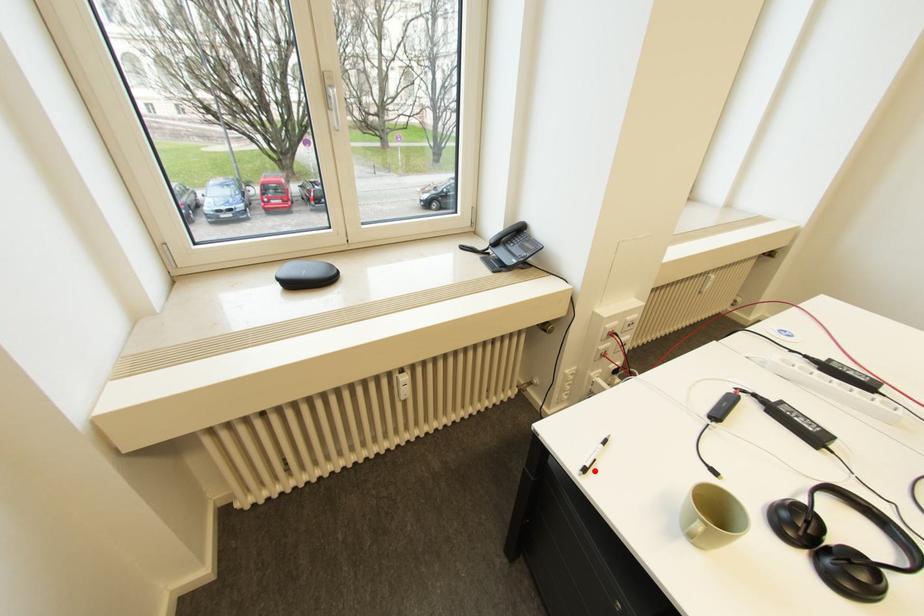
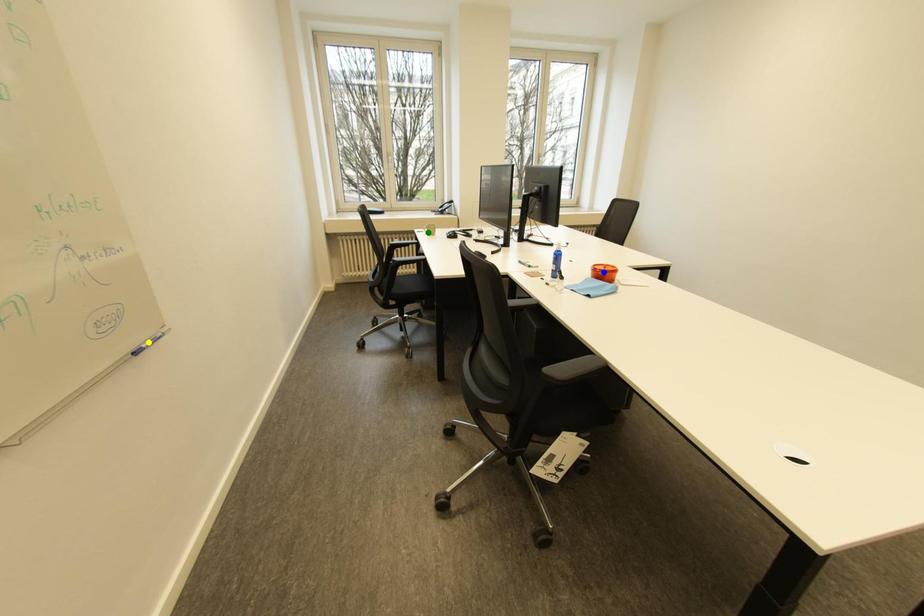
Question: I am providing you with two images of the same scene from different viewpoints. A red point is marked on the first image. You are given multiple points on the second image. Can you choose the point in image 2 that corresponds to the point in image 1?

Choices:
 (A) green point
 (B) blue point
 (C) yellow point

Answer: (A)